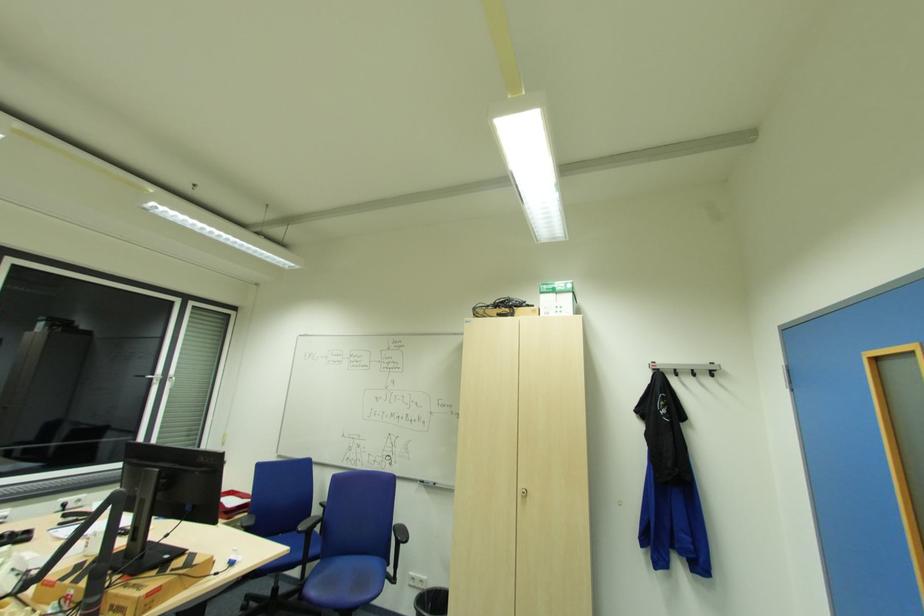
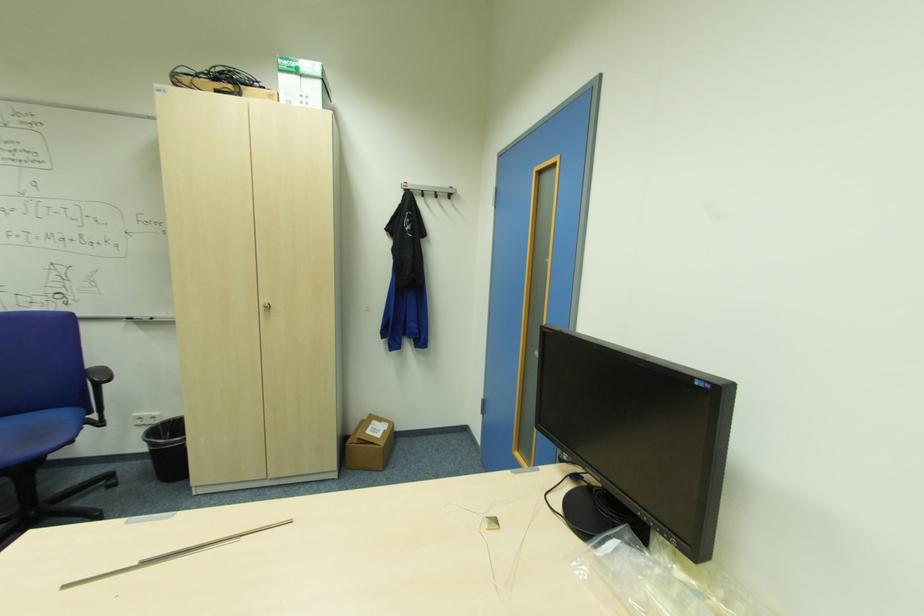
Locate, in the second image, the point that corresponds to pixel 695 370 in the first image.

(439, 192)